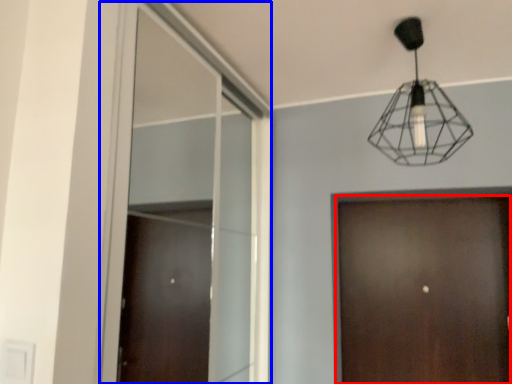
Question: Which point is further to the camera, door (highlighted by a red box) or window (highlighted by a blue box)?

Choices:
 (A) door
 (B) window

Answer: (A)